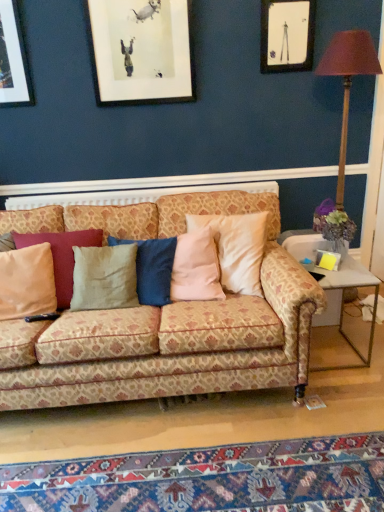
Question: Is carpet with intricate patterns at lower center positioned behind metal/glass side table at lower right?

Choices:
 (A) no
 (B) yes

Answer: (A)

Question: Is carpet with intricate patterns at lower center oriented away from metal/glass side table at lower right?

Choices:
 (A) yes
 (B) no

Answer: (B)

Question: Is carpet with intricate patterns at lower center positioned before metal/glass side table at lower right?

Choices:
 (A) yes
 (B) no

Answer: (A)

Question: Is carpet with intricate patterns at lower center directly adjacent to metal/glass side table at lower right?

Choices:
 (A) no
 (B) yes

Answer: (A)

Question: From a real-world perspective, is carpet with intricate patterns at lower center under metal/glass side table at lower right?

Choices:
 (A) yes
 (B) no

Answer: (A)

Question: From a real-world perspective, is metallic gold table lamp at right physically located above or below patterned fabric couch at center?

Choices:
 (A) below
 (B) above

Answer: (B)

Question: Choose the correct answer: Is metallic gold table lamp at right inside patterned fabric couch at center or outside it?

Choices:
 (A) outside
 (B) inside

Answer: (A)

Question: In terms of size, does metallic gold table lamp at right appear bigger or smaller than patterned fabric couch at center?

Choices:
 (A) big
 (B) small

Answer: (B)

Question: From the image's perspective, is metallic gold table lamp at right positioned above or below patterned fabric couch at center?

Choices:
 (A) below
 (B) above

Answer: (B)

Question: Is matte black picture frame at upper right in front of or behind beige fabric pillow at left in the image?

Choices:
 (A) behind
 (B) front

Answer: (A)

Question: From a real-world perspective, relative to beige fabric pillow at left, is matte black picture frame at upper right vertically above or below?

Choices:
 (A) above
 (B) below

Answer: (A)

Question: Is matte black picture frame at upper right to the left or to the right of beige fabric pillow at left in the image?

Choices:
 (A) left
 (B) right

Answer: (B)

Question: Considering the positions of matte black picture frame at upper right and beige fabric pillow at left in the image, is matte black picture frame at upper right wider or thinner than beige fabric pillow at left?

Choices:
 (A) wide
 (B) thin

Answer: (B)

Question: Does point pyautogui.click(x=1, y=482) appear closer or farther from the camera than point pyautogui.click(x=271, y=71)?

Choices:
 (A) closer
 (B) farther

Answer: (A)

Question: From the image's perspective, relative to matte black picture frame at upper right, is carpet with intricate patterns at lower center above or below?

Choices:
 (A) above
 (B) below

Answer: (B)